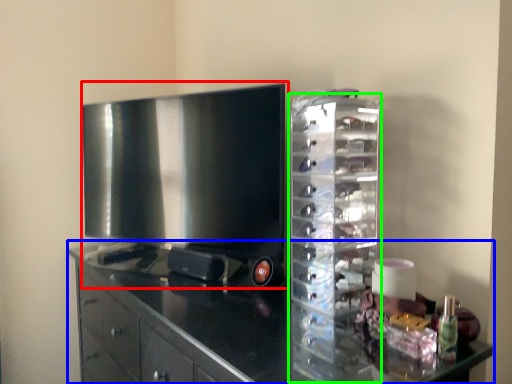
Question: Based on their relative distances, which object is nearer to home appliance (highlighted by a red box)? Choose from cabinetry (highlighted by a blue box) and glass box (highlighted by a green box).

Choices:
 (A) cabinetry
 (B) glass box

Answer: (A)